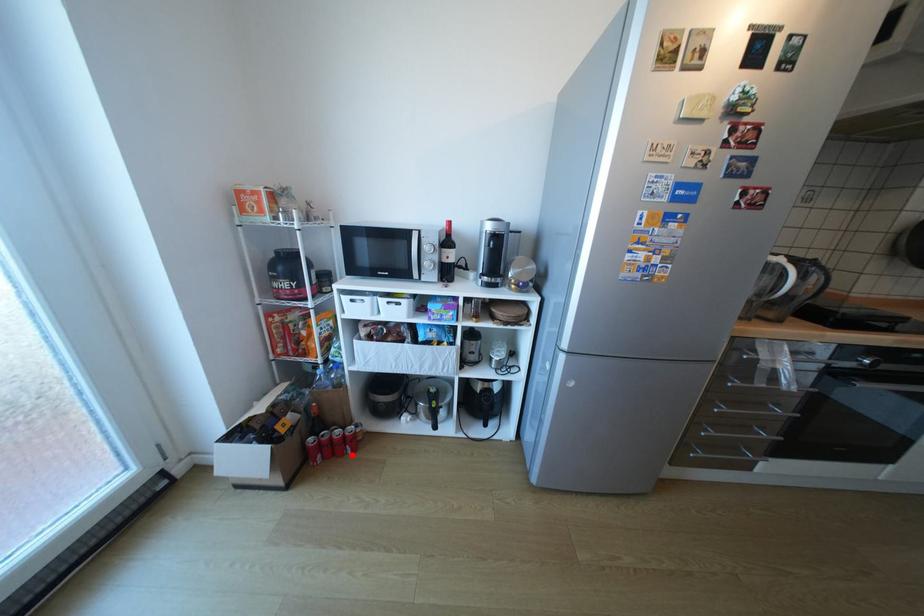
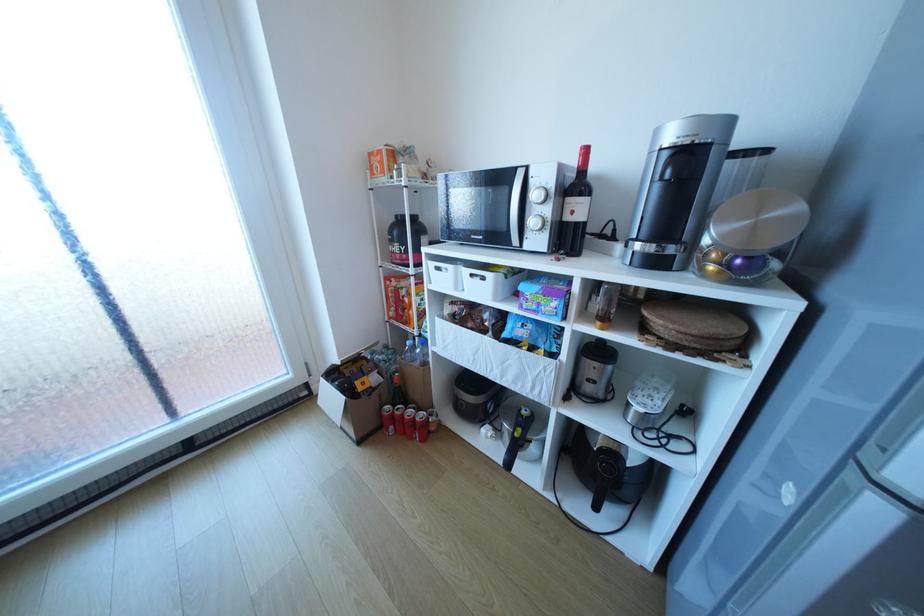
Find the pixel in the second image that matches the highlighted location in the first image.

(420, 438)